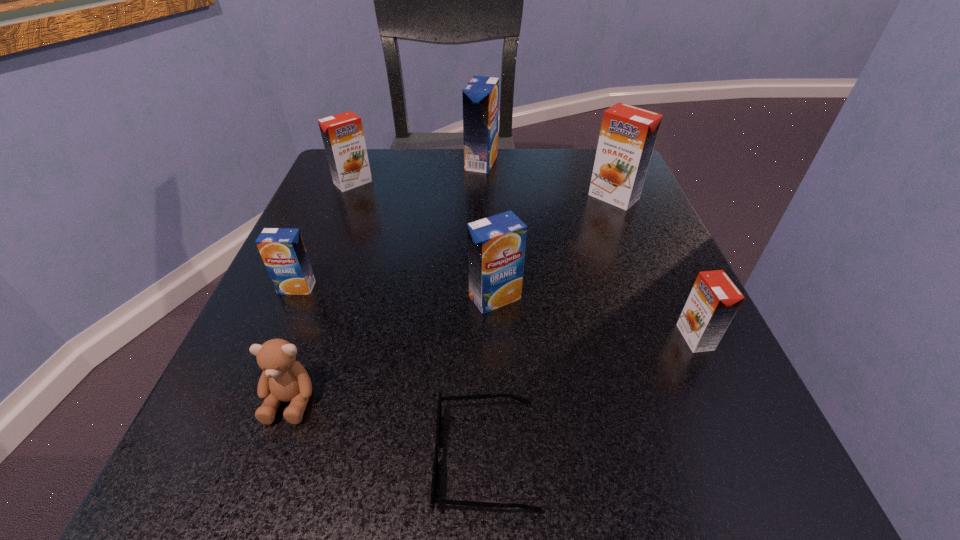
Where is `the fourth closest orange juice to the smallest blue orange_juice`? the fourth closest orange juice to the smallest blue orange_juice is located at coordinates (628, 134).

Locate which blue orange_juice ranks in proximity to the second smallest blue orange_juice. Please provide its 2D coordinates. Your answer should be formatted as a tuple, i.e. [(x, y)], where the tuple contains the x and y coordinates of a point satisfying the conditions above.

[(282, 249)]

At what (x,y) coordinates should I click in order to perform the action: click on the closest blue orange_juice to the leftmost orange orange juice. Please return your answer as a coordinate pair (x, y). This screenshot has width=960, height=540. Looking at the image, I should click on (480, 96).

Select which orange orange juice appears as the second closest to the nearest orange juice. Please provide its 2D coordinates. Your answer should be formatted as a tuple, i.e. [(x, y)], where the tuple contains the x and y coordinates of a point satisfying the conditions above.

[(342, 134)]

Locate which orange orange juice ranks second in proximity to the nearest orange orange juice. Please provide its 2D coordinates. Your answer should be formatted as a tuple, i.e. [(x, y)], where the tuple contains the x and y coordinates of a point satisfying the conditions above.

[(342, 134)]

Where is `free space that satisfies the following two spatial constraints: 1. on the front side of the nearest orange orange juice; 2. on the left side of the biggest blue orange_juice`? free space that satisfies the following two spatial constraints: 1. on the front side of the nearest orange orange juice; 2. on the left side of the biggest blue orange_juice is located at coordinates (482, 337).

Where is `free space that satisfies the following two spatial constraints: 1. on the back side of the second smallest orange orange juice; 2. on the right side of the biggest blue orange_juice`? free space that satisfies the following two spatial constraints: 1. on the back side of the second smallest orange orange juice; 2. on the right side of the biggest blue orange_juice is located at coordinates (x=361, y=163).